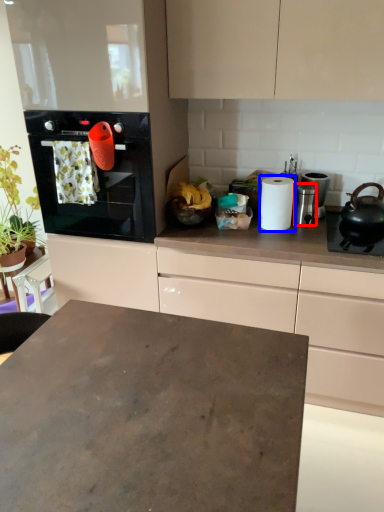
Question: Which point is further to the camera, appliance (highlighted by a red box) or paper towel (highlighted by a blue box)?

Choices:
 (A) appliance
 (B) paper towel

Answer: (A)